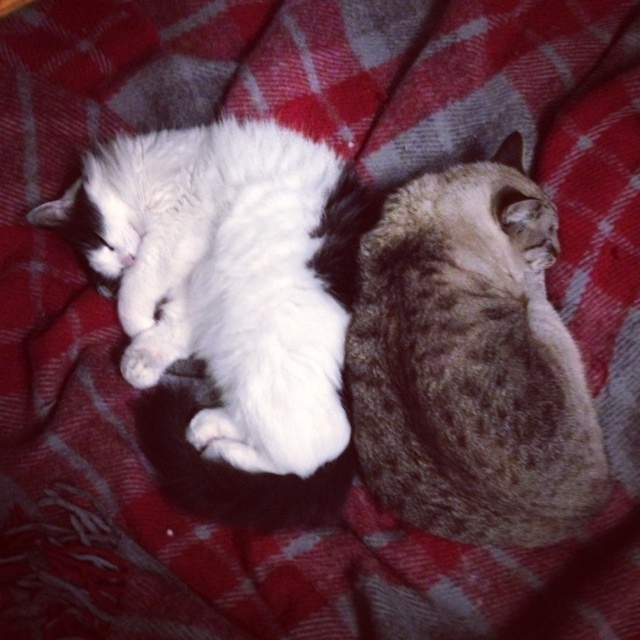
Question: Which of the following is the closest to the observer?

Choices:
 (A) (378, 413)
 (B) (198, 272)

Answer: (A)

Question: Observing the image, what is the correct spatial positioning of gray textured cat at center in reference to white fluffy cat at upper left?

Choices:
 (A) left
 (B) right

Answer: (B)

Question: Which of the following is the closest to the observer?

Choices:
 (A) (582, 518)
 (B) (236, 124)

Answer: (A)

Question: Can you confirm if gray textured cat at center is bigger than white fluffy cat at upper left?

Choices:
 (A) yes
 (B) no

Answer: (B)

Question: Can you confirm if gray textured cat at center is positioned above white fluffy cat at upper left?

Choices:
 (A) yes
 (B) no

Answer: (B)

Question: Among these points, which one is nearest to the camera?

Choices:
 (A) (570, 428)
 (B) (230, 230)

Answer: (A)